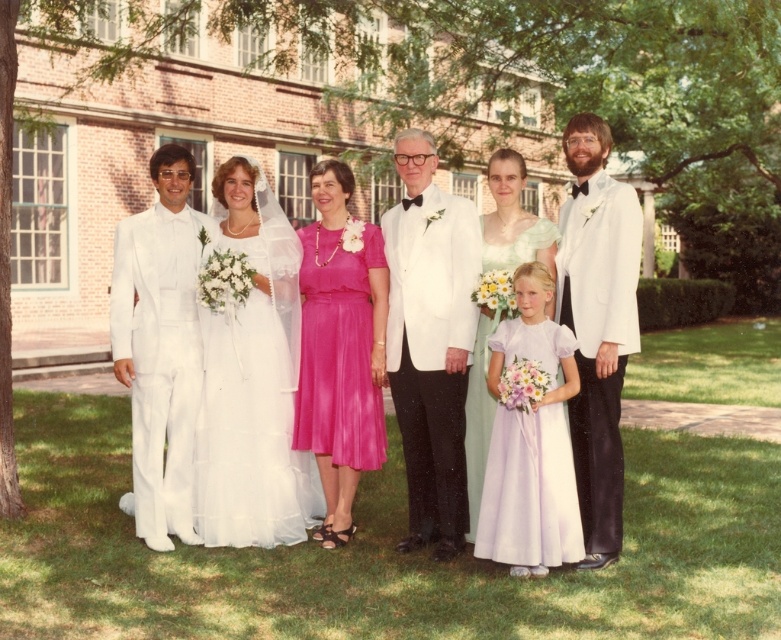
You are standing at the edge of the grassy area and want to place a small bench exactly at the center of the green grass at center. According to the coordinates provided, where should you place the bench?

The coordinates for the green grass at center are given as point (382, 552), so you should place the bench at those exact coordinates to position it precisely at the center of the green grass at center.

Based on the scene description, what is located at the coordinates point (382,552)?

The coordinates point (382,552) has green grass at center.

You are a photographer setting up for a group photo. You need to ensure that the green grass at center is visible behind the pink satin dress at center. Based on their heights, is this possible?

The green grass at center is not as tall as the pink satin dress at center, so the grass will be visible behind the dress.